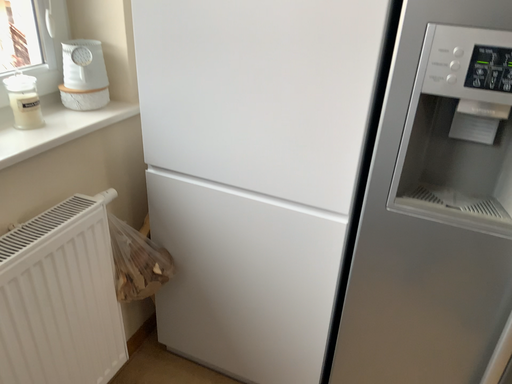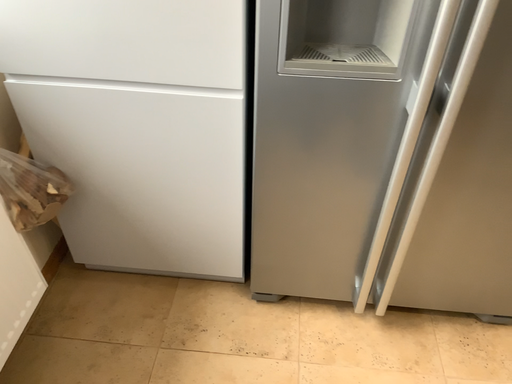
Question: Which way did the camera rotate in the video?

Choices:
 (A) rotated right
 (B) rotated left

Answer: (A)